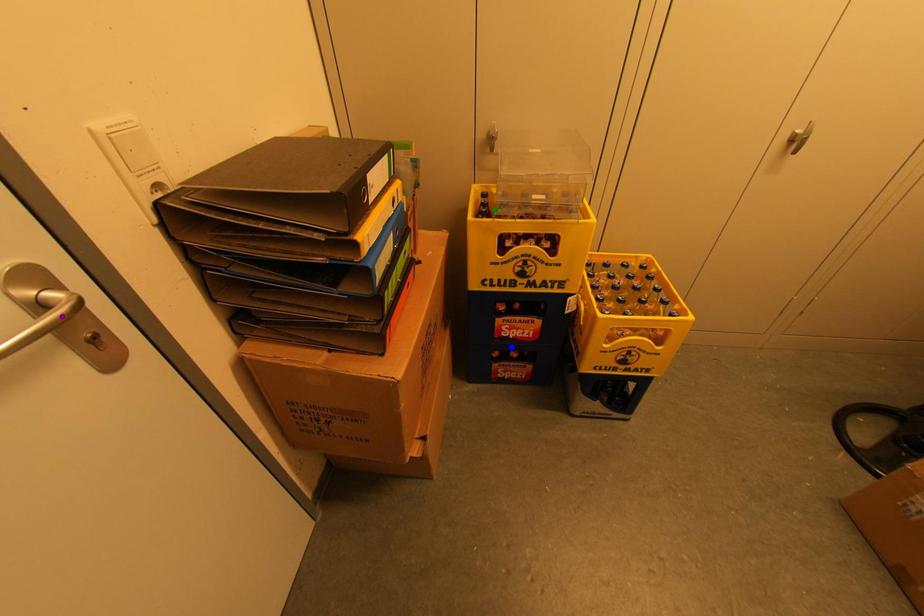
Order these from farthest to nearest:
1. green point
2. blue point
3. purple point

blue point → green point → purple point